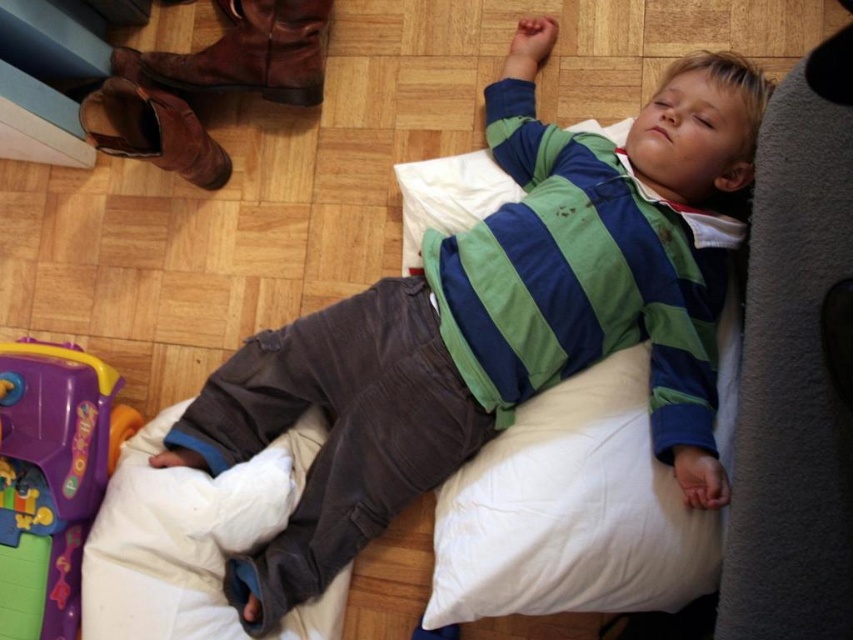
Question: Which point appears closest to the camera in this image?

Choices:
 (A) (62, 452)
 (B) (618, 157)

Answer: (B)

Question: Considering the relative positions of green striped shirt at center and purple plastic toy at lower left in the image provided, where is green striped shirt at center located with respect to purple plastic toy at lower left?

Choices:
 (A) right
 (B) left

Answer: (A)

Question: Does green striped shirt at center appear over purple plastic toy at lower left?

Choices:
 (A) yes
 (B) no

Answer: (A)

Question: Where is green striped shirt at center located in relation to purple plastic toy at lower left in the image?

Choices:
 (A) above
 (B) below

Answer: (A)